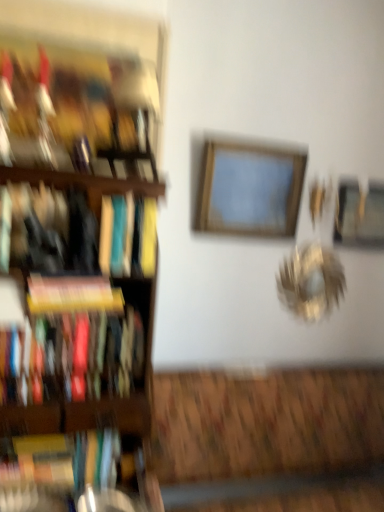
Question: From the image's perspective, is yellow matte book at left, acting as the third book starting from the bottom, located above or below wooden frame at center, placed as the second picture frame when sorted from right to left?

Choices:
 (A) above
 (B) below

Answer: (B)

Question: In terms of width, does yellow matte book at left, acting as the third book starting from the bottom, look wider or thinner when compared to wooden frame at center, which is the 2th picture frame from back to front?

Choices:
 (A) wide
 (B) thin

Answer: (A)

Question: Estimate the real-world distances between objects in this image. Which object is closer to the black matte bookshelf at left, acting as the 2th book starting from the top?

Choices:
 (A) hardcover book at left, acting as the first book starting from the bottom
 (B) yellow matte book at left, acting as the third book starting from the bottom
 (C) matte hardcover book at left, which is the 4th book from top to bottom
 (D) hardcover book at left, the first book positioned from the top
 (E) wooden bookshelf at left

Answer: (B)

Question: Estimate the real-world distances between objects in this image. Which object is closer to the black matte bookshelf at left, the 4th book ordered from the bottom?

Choices:
 (A) yellow matte book at left, the third book when ordered from top to bottom
 (B) metallic gold picture frame at upper right, placed as the second picture frame when sorted from front to back
 (C) hardcover book at left, the first book positioned from the top
 (D) wooden frame at center, which is the 2th picture frame from back to front
 (E) hardcover book at left, acting as the first book starting from the bottom

Answer: (A)